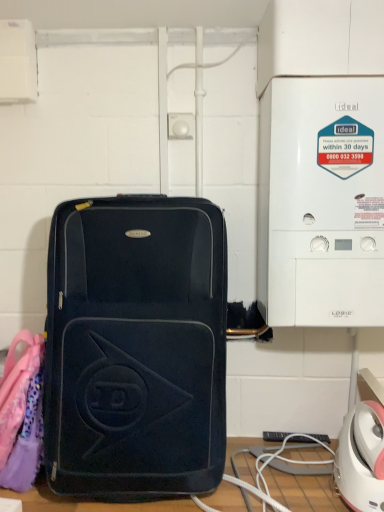
Image resolution: width=384 pixels, height=512 pixels. What do you see at coordinates (322, 201) in the screenshot?
I see `white plastic boiler at right` at bounding box center [322, 201].

Locate an element on the screen. white plastic boiler at right is located at coordinates (322, 201).

Where is `matte black suitcase at center`? Image resolution: width=384 pixels, height=512 pixels. matte black suitcase at center is located at coordinates (135, 347).

This screenshot has width=384, height=512. What do you see at coordinates (135, 347) in the screenshot?
I see `matte black suitcase at center` at bounding box center [135, 347].

In order to face matte black suitcase at center, should I rotate leftwards or rightwards?

Turn left by 6.283 degrees to look at matte black suitcase at center.

Measure the distance between matte black suitcase at center and camera.

matte black suitcase at center is 1.12 meters away from camera.

Measure the distance between point (192, 337) and camera.

The depth of point (192, 337) is 1.13 meters.

I want to click on white plastic boiler at right, so 322,201.

Which object is positioned more to the right, white plastic boiler at right or matte black suitcase at center?

white plastic boiler at right.

Looking at this image, is the position of white plastic boiler at right more distant than that of matte black suitcase at center?

Yes, white plastic boiler at right is behind matte black suitcase at center.

Is point (263, 160) positioned after point (123, 426)?

That is True.

From the image's perspective, is white plastic boiler at right located above or below matte black suitcase at center?

white plastic boiler at right is above matte black suitcase at center.

From a real-world perspective, which object rests below the other?

matte black suitcase at center.

Considering the relative sizes of white plastic boiler at right and matte black suitcase at center in the image provided, is white plastic boiler at right wider than matte black suitcase at center?

No, white plastic boiler at right is not wider than matte black suitcase at center.

Can you confirm if white plastic boiler at right is shorter than matte black suitcase at center?

No, white plastic boiler at right is not shorter than matte black suitcase at center.

Considering the relative sizes of white plastic boiler at right and matte black suitcase at center in the image provided, is white plastic boiler at right smaller than matte black suitcase at center?

Correct, white plastic boiler at right occupies less space than matte black suitcase at center.

Can we say white plastic boiler at right lies outside matte black suitcase at center?

That's correct, white plastic boiler at right is outside of matte black suitcase at center.

Is the surface of white plastic boiler at right in direct contact with matte black suitcase at center?

No, white plastic boiler at right is not making contact with matte black suitcase at center.

From the picture: Is white plastic boiler at right turned away from matte black suitcase at center?

No, white plastic boiler at right's orientation is not away from matte black suitcase at center.

Can you tell me how much white plastic boiler at right and matte black suitcase at center differ in facing direction?

The angular difference between white plastic boiler at right and matte black suitcase at center is 4.04 degrees.

This screenshot has width=384, height=512. Identify the location of appliance lying above the matte black suitcase at center (from the image's perspective). (322, 201).

Based on their positions, is matte black suitcase at center located to the left or right of white plastic boiler at right?

matte black suitcase at center is to the left of white plastic boiler at right.

Which is behind, matte black suitcase at center or white plastic boiler at right?

white plastic boiler at right is further from the camera.

From the picture: Which is nearer, (x=222, y=327) or (x=302, y=209)?

Point (x=222, y=327) appears to be farther away from the viewer than point (x=302, y=209).

From the image's perspective, is matte black suitcase at center beneath white plastic boiler at right?

Indeed, from the image's perspective, matte black suitcase at center is shown beneath white plastic boiler at right.

From a real-world perspective, is matte black suitcase at center positioned above or below white plastic boiler at right?

matte black suitcase at center is situated lower than white plastic boiler at right in the real world.

Does matte black suitcase at center have a lesser width compared to white plastic boiler at right?

No, matte black suitcase at center is not thinner than white plastic boiler at right.

From their relative heights in the image, would you say matte black suitcase at center is taller or shorter than white plastic boiler at right?

Clearly, matte black suitcase at center is shorter compared to white plastic boiler at right.

Considering the sizes of objects matte black suitcase at center and white plastic boiler at right in the image provided, who is bigger, matte black suitcase at center or white plastic boiler at right?

matte black suitcase at center is bigger.

Is matte black suitcase at center outside of white plastic boiler at right?

Yes, matte black suitcase at center is located beyond the bounds of white plastic boiler at right.

Is matte black suitcase at center next to white plastic boiler at right and touching it?

No, matte black suitcase at center is not touching white plastic boiler at right.

Is matte black suitcase at center facing away from white plastic boiler at right?

No, matte black suitcase at center is not facing the opposite direction of white plastic boiler at right.

Where is `appliance on the right of matte black suitcase at center`? The image size is (384, 512). appliance on the right of matte black suitcase at center is located at coordinates (322, 201).

The image size is (384, 512). I want to click on appliance on the right of matte black suitcase at center, so click(322, 201).

This screenshot has height=512, width=384. What are the coordinates of `appliance behind the matte black suitcase at center` in the screenshot? It's located at click(322, 201).